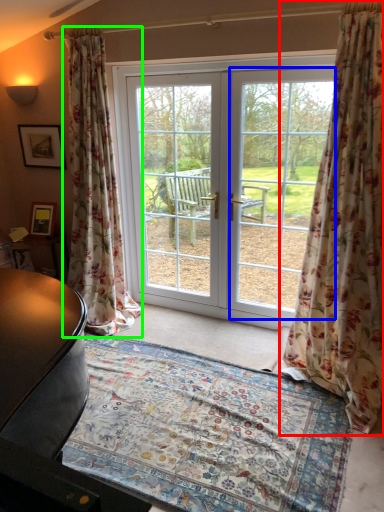
Question: Considering the real-world distances, which object is farthest from curtain (highlighted by a red box)? window screen (highlighted by a blue box) or curtain (highlighted by a green box)?

Choices:
 (A) window screen
 (B) curtain

Answer: (B)